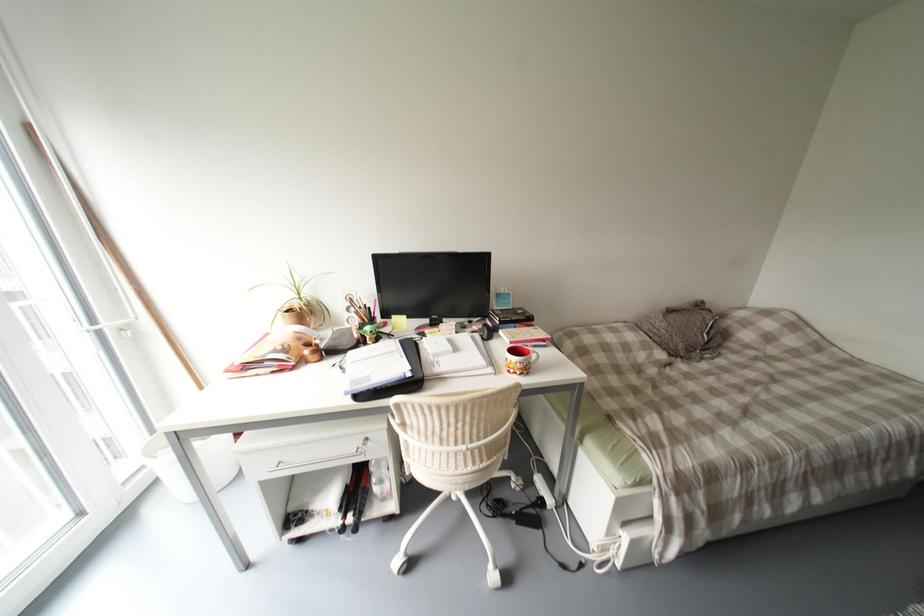
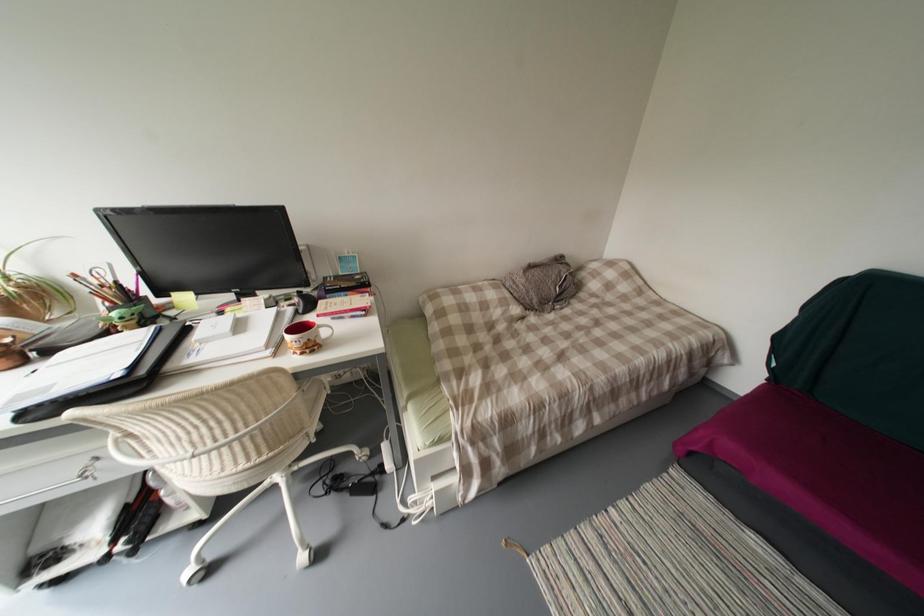
Question: The images are taken continuously from a first-person perspective. In which direction are you moving?

Choices:
 (A) Left
 (B) Right
 (C) Forward
 (D) Backward

Answer: (B)